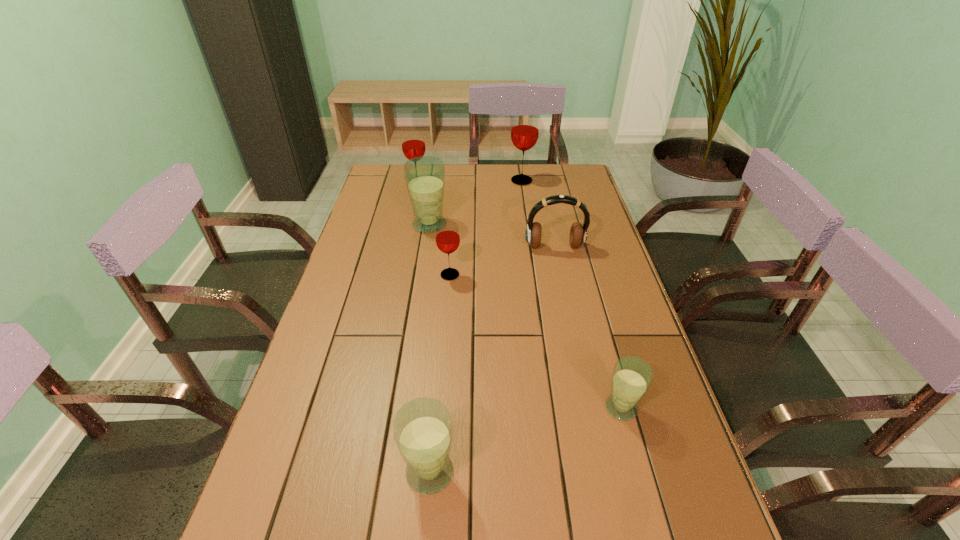
You are a GUI agent. You are given a task and a screenshot of the screen. Output one action in this format:
    pyautogui.click(x=<x>, y=<y>)
    Task: Click on the vacant space in between the sixth farthest object and the smallest red glass
    The height and width of the screenshot is (540, 960).
    Given the screenshot: What is the action you would take?
    pyautogui.click(x=536, y=341)

Locate an element on the screen. The image size is (960, 540). vacant area that lies between the fifth nearest object and the brown headset is located at coordinates (492, 236).

Image resolution: width=960 pixels, height=540 pixels. Identify the location of vacant area that lies between the biggest red glass and the second nearest glass. (571, 294).

Where is `empty space that is in between the second farthest blue glass and the second red glass from right to left`? The image size is (960, 540). empty space that is in between the second farthest blue glass and the second red glass from right to left is located at coordinates (536, 341).

At what (x,y) coordinates should I click in order to perform the action: click on vacant point located between the smallest red glass and the shortest object. Please return your answer as a coordinate pair (x, y). The width and height of the screenshot is (960, 540). Looking at the image, I should click on (536, 341).

What are the coordinates of `the closest object to the second smallest blue glass` in the screenshot? It's located at (631, 378).

Image resolution: width=960 pixels, height=540 pixels. I want to click on object that can be found as the sixth closest to the biggest blue glass, so click(x=422, y=428).

Identify which glass is the third closest to the second red glass from left to right. Please provide its 2D coordinates. Your answer should be formatted as a tuple, i.e. [(x, y)], where the tuple contains the x and y coordinates of a point satisfying the conditions above.

[(631, 378)]

Point out which glass is positioned as the nearest to the second smallest red glass. Please provide its 2D coordinates. Your answer should be formatted as a tuple, i.e. [(x, y)], where the tuple contains the x and y coordinates of a point satisfying the conditions above.

[(425, 176)]

Identify which red glass is the third closest to the headset. Please provide its 2D coordinates. Your answer should be formatted as a tuple, i.e. [(x, y)], where the tuple contains the x and y coordinates of a point satisfying the conditions above.

[(413, 143)]